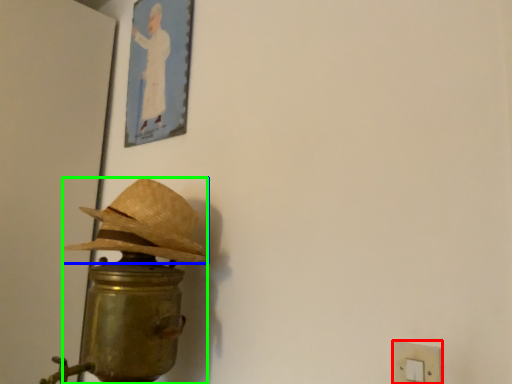
Question: Which is nearer to the light switch (highlighted by a red box)? hat (highlighted by a blue box) or table lamp (highlighted by a green box).

Choices:
 (A) hat
 (B) table lamp

Answer: (B)